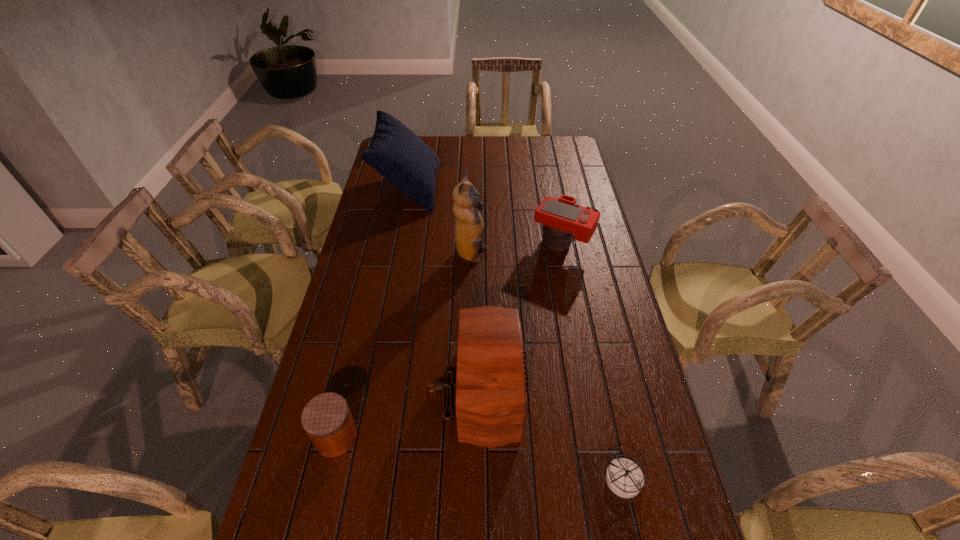
At what (x,y) coordinates should I click in order to perform the action: click on vacant space at the right edge. Please return your answer as a coordinate pair (x, y). This screenshot has width=960, height=540. Looking at the image, I should click on (655, 511).

I want to click on vacant space at the far right corner of the desktop, so click(564, 144).

The width and height of the screenshot is (960, 540). I want to click on vacant space in between the nearest object and the third shortest object, so click(x=593, y=361).

This screenshot has width=960, height=540. Identify the location of free space between the farthest object and the radio receiver. (444, 288).

Where is `free space that is in between the cat and the jar`? Image resolution: width=960 pixels, height=540 pixels. free space that is in between the cat and the jar is located at coordinates (404, 346).

You are a GUI agent. You are given a task and a screenshot of the screen. Output one action in this format:
    pyautogui.click(x=<x>, y=<y>)
    Task: Click on the vacant space that's between the jar and the cat
    
    Given the screenshot: What is the action you would take?
    pyautogui.click(x=404, y=346)

Locate an element on the screen. free space between the radio receiver and the third shortest object is located at coordinates (520, 316).

You are a GUI agent. You are given a task and a screenshot of the screen. Output one action in this format:
    pyautogui.click(x=<x>, y=<y>)
    Task: Click on the vacant space that's between the radio receiver and the third shortest object
    Image resolution: width=960 pixels, height=540 pixels.
    Given the screenshot: What is the action you would take?
    pyautogui.click(x=520, y=316)

Find the location of a particular element. The width and height of the screenshot is (960, 540). free area in between the jar and the fourth shortest object is located at coordinates (407, 413).

Identify the location of vacant area between the radio receiver and the camera. (520, 316).